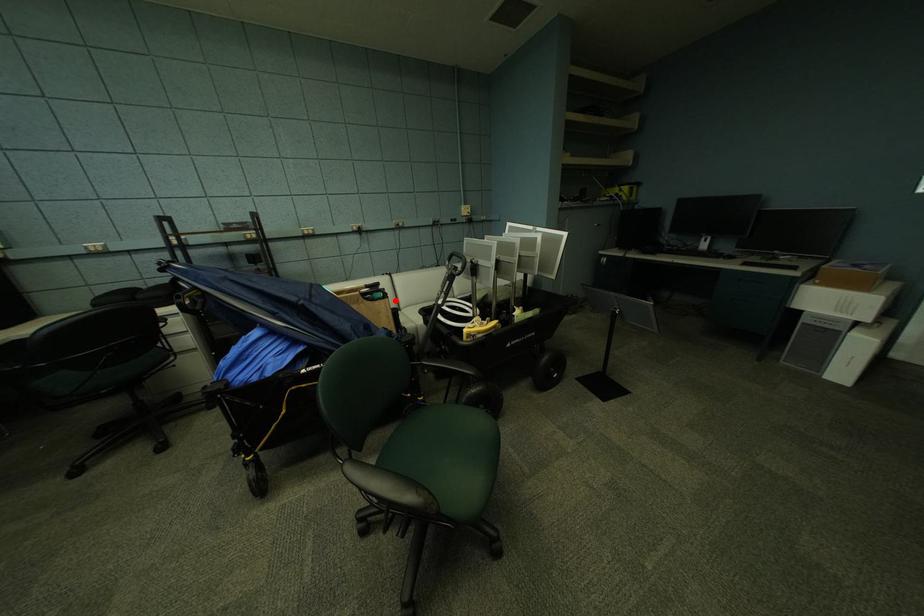
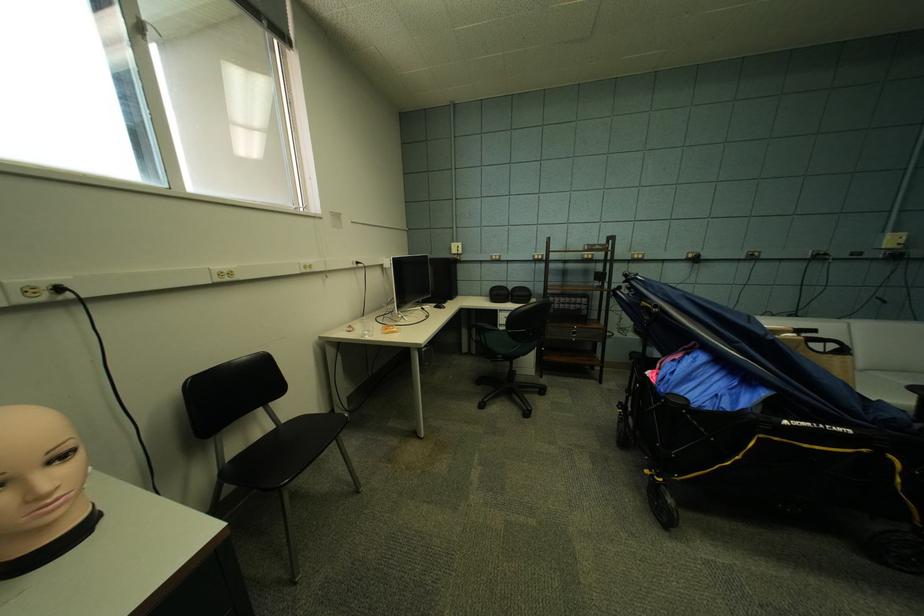
The point at the highlighted location is marked in the first image. Where is the corresponding point in the second image?

(857, 358)